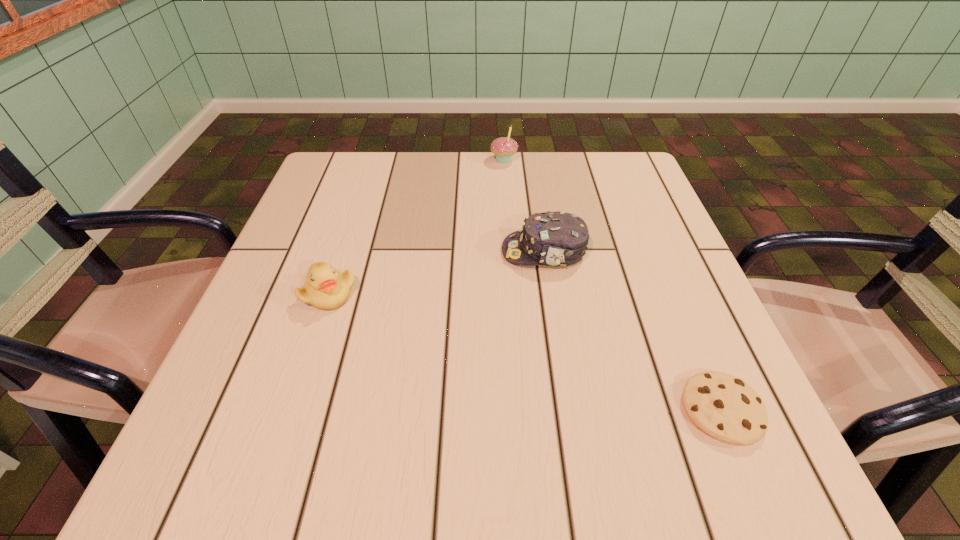
The height and width of the screenshot is (540, 960). I want to click on free space between the tallest object and the headwear, so click(524, 206).

Find the location of a particular element. free spot between the rightmost object and the farthest object is located at coordinates (612, 285).

Find the location of a particular element. empty location between the farthest object and the second nearest object is located at coordinates (417, 227).

This screenshot has height=540, width=960. What are the coordinates of `free space between the third farthest object and the nearest object` in the screenshot? It's located at (525, 352).

The height and width of the screenshot is (540, 960). What are the coordinates of `free area in between the second farthest object and the cupcake` in the screenshot? It's located at (524, 206).

The width and height of the screenshot is (960, 540). Identify the location of the third closest object to the leftmost object. (725, 407).

Point out which object is positioned as the second nearest to the headwear. Please provide its 2D coordinates. Your answer should be formatted as a tuple, i.e. [(x, y)], where the tuple contains the x and y coordinates of a point satisfying the conditions above.

[(504, 148)]

Locate an element on the screen. vacant region that satisfies the following two spatial constraints: 1. on the beak of the leftmost object; 2. on the left side of the cookie is located at coordinates (290, 410).

The width and height of the screenshot is (960, 540). In order to click on vacant area in the image that satisfies the following two spatial constraints: 1. on the front-facing side of the headwear; 2. on the beak of the duckling in this screenshot , I will do `click(551, 293)`.

Identify the location of free space that satisfies the following two spatial constraints: 1. on the front-facing side of the headwear; 2. on the back side of the nearest object. The height and width of the screenshot is (540, 960). (569, 410).